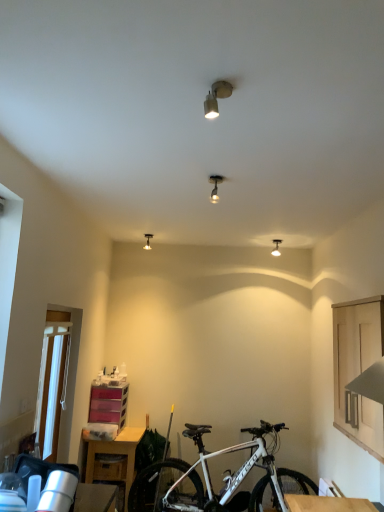
Question: Can you confirm if transparent glass door at left is positioned to the right of white matte bicycle at lower center?

Choices:
 (A) no
 (B) yes

Answer: (A)

Question: Would you say transparent glass door at left contains white matte bicycle at lower center?

Choices:
 (A) no
 (B) yes

Answer: (A)

Question: Does transparent glass door at left have a greater width compared to white matte bicycle at lower center?

Choices:
 (A) yes
 (B) no

Answer: (B)

Question: Is transparent glass door at left positioned with its back to white matte bicycle at lower center?

Choices:
 (A) yes
 (B) no

Answer: (B)

Question: Is transparent glass door at left taller than white matte bicycle at lower center?

Choices:
 (A) yes
 (B) no

Answer: (B)

Question: Is metallic track light at center, placed as the 3th light fixture when sorted from left to right, taller or shorter than matte silver light fixture at upper center, which is counted as the first light fixture, starting from the back?

Choices:
 (A) tall
 (B) short

Answer: (B)

Question: In the image, is metallic track light at center, which is the 3th light fixture in back-to-front order, positioned in front of or behind matte silver light fixture at upper center, which appears as the 4th light fixture when viewed from the front?

Choices:
 (A) front
 (B) behind

Answer: (A)

Question: From a real-world perspective, is metallic track light at center, which is the second light fixture from right to left, above or below matte silver light fixture at upper center, positioned as the 4th light fixture in right-to-left order?

Choices:
 (A) above
 (B) below

Answer: (B)

Question: Is metallic track light at center, which is the second light fixture from right to left, bigger or smaller than matte silver light fixture at upper center, which appears as the 4th light fixture when viewed from the front?

Choices:
 (A) big
 (B) small

Answer: (A)

Question: Considering the positions of point (122, 460) and point (145, 237), is point (122, 460) closer or farther from the camera than point (145, 237)?

Choices:
 (A) farther
 (B) closer

Answer: (B)

Question: From a real-world perspective, is wooden table at lower left, which is the second table in top-to-bottom order, positioned above or below matte silver light fixture at upper center, which appears as the second light fixture when ordered from the bottom?

Choices:
 (A) above
 (B) below

Answer: (B)

Question: Do you think wooden table at lower left, which is the second table in top-to-bottom order, is within matte silver light fixture at upper center, positioned as the 4th light fixture in right-to-left order, or outside of it?

Choices:
 (A) outside
 (B) inside

Answer: (A)

Question: From the image's perspective, is wooden table at lower left, the second table positioned from the right, located above or below matte silver light fixture at upper center, the 3th light fixture in the top-to-bottom sequence?

Choices:
 (A) above
 (B) below

Answer: (B)

Question: Looking at their shapes, would you say wooden table at lower left, the second table positioned from the right, is wider or thinner than matte silver spotlight at upper center, the 4th light fixture from the back?

Choices:
 (A) thin
 (B) wide

Answer: (B)

Question: In the image, is wooden table at lower left, which is the first table from bottom to top, on the left side or the right side of matte silver spotlight at upper center, marked as the first light fixture in a top-to-bottom arrangement?

Choices:
 (A) left
 (B) right

Answer: (A)